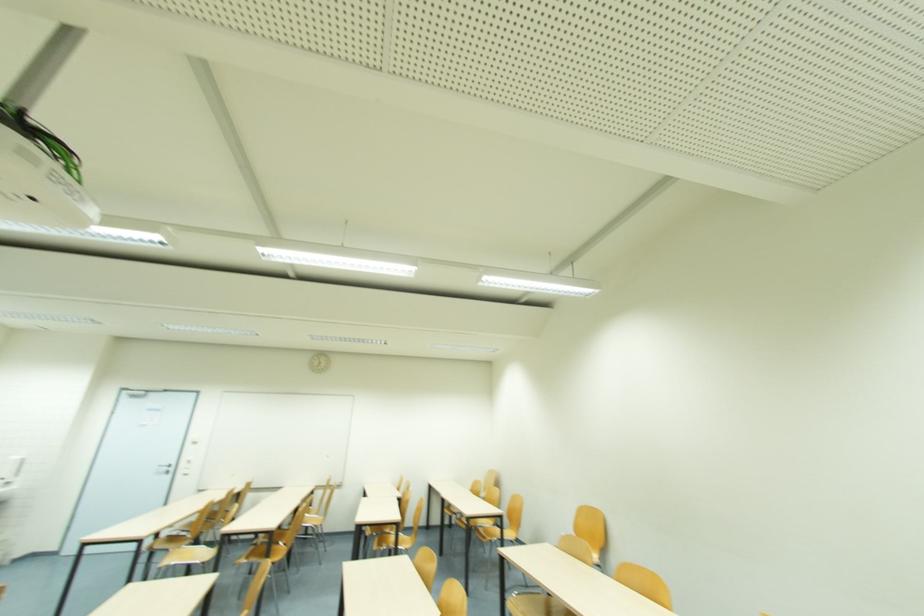
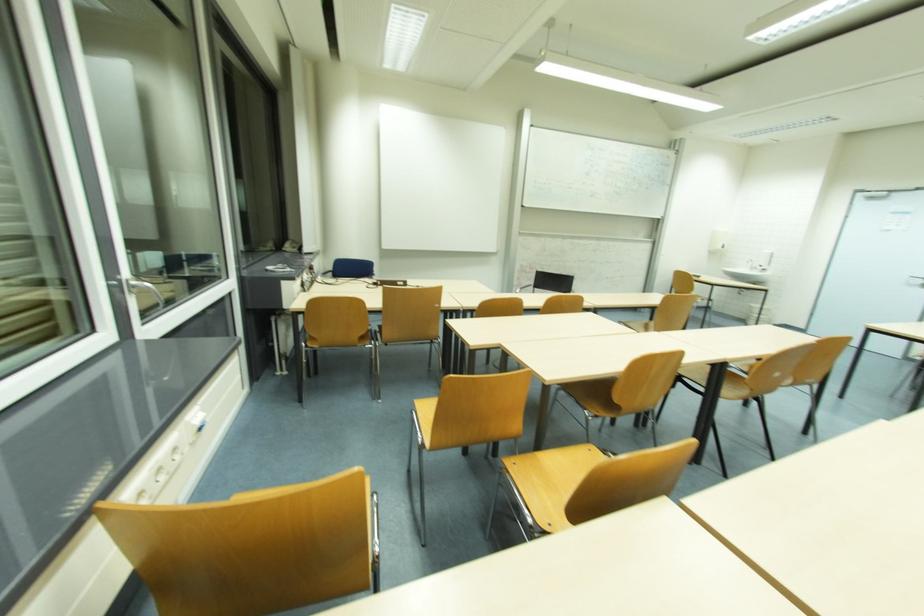
Question: The first image is from the beginning of the video and the second image is from the end. How did the camera likely rotate when shooting the video?

Choices:
 (A) Left
 (B) Right
 (C) Up
 (D) Down

Answer: (A)